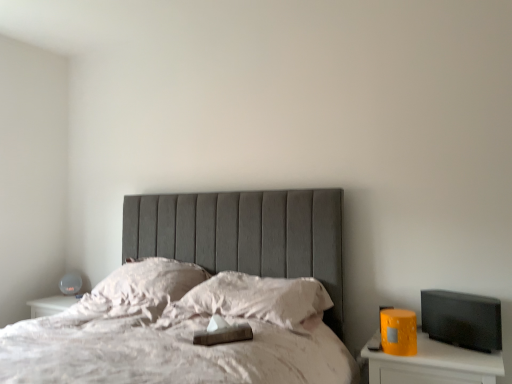
Image resolution: width=512 pixels, height=384 pixels. In order to click on white soft pillow at center, marked as the first pillow in a left-to-right arrangement in this screenshot , I will do `click(139, 290)`.

The image size is (512, 384). Identify the location of matte yellow nightstand at right. (434, 365).

Image resolution: width=512 pixels, height=384 pixels. Find the location of `white soft pillow at center, which ranks as the first pillow in right-to-left order`. white soft pillow at center, which ranks as the first pillow in right-to-left order is located at coordinates [251, 300].

Is matte white table lamp at left looking in the opposite direction of white soft pillow at center, which ranks as the first pillow in right-to-left order?

matte white table lamp at left does not have its back to white soft pillow at center, which ranks as the first pillow in right-to-left order.

Who is bigger, matte white table lamp at left or white soft pillow at center, which ranks as the first pillow in right-to-left order?

With larger size is white soft pillow at center, which ranks as the first pillow in right-to-left order.

Is white soft pillow at center, which ranks as the first pillow in right-to-left order, inside matte white table lamp at left?

No, white soft pillow at center, which ranks as the first pillow in right-to-left order, is located outside of matte white table lamp at left.

Which is more to the left, matte white table lamp at left or white soft pillow at center, which ranks as the first pillow in right-to-left order?

matte white table lamp at left is more to the left.

Based on the photo, from a real-world perspective, is white soft pillow at center, the 2th pillow when ordered from left to right, beneath white soft pillow at center, arranged as the 2th pillow when viewed from the right?

Indeed, from a real-world perspective, white soft pillow at center, the 2th pillow when ordered from left to right, is positioned beneath white soft pillow at center, arranged as the 2th pillow when viewed from the right.

Which object is further away from the camera, white soft pillow at center, which ranks as the first pillow in right-to-left order, or white soft pillow at center, arranged as the 2th pillow when viewed from the right?

white soft pillow at center, arranged as the 2th pillow when viewed from the right.

Considering the sizes of objects white soft pillow at center, which ranks as the first pillow in right-to-left order, and white soft pillow at center, arranged as the 2th pillow when viewed from the right, in the image provided, who is thinner, white soft pillow at center, which ranks as the first pillow in right-to-left order, or white soft pillow at center, arranged as the 2th pillow when viewed from the right,?

white soft pillow at center, which ranks as the first pillow in right-to-left order.

Is matte white table lamp at left at the back of white soft pillow at center, marked as the first pillow in a left-to-right arrangement?

No, matte white table lamp at left is not at the back of white soft pillow at center, marked as the first pillow in a left-to-right arrangement.

Between white soft pillow at center, marked as the first pillow in a left-to-right arrangement, and matte white table lamp at left, which one has larger size?

white soft pillow at center, marked as the first pillow in a left-to-right arrangement.

Is there a large distance between white soft pillow at center, marked as the first pillow in a left-to-right arrangement, and matte white table lamp at left?

No, there isn't a large distance between white soft pillow at center, marked as the first pillow in a left-to-right arrangement, and matte white table lamp at left.

From the image's perspective, who appears lower, white soft pillow at center, the 2th pillow when ordered from left to right, or matte yellow nightstand at right?

matte yellow nightstand at right appears lower in the image.

Could you tell me if white soft pillow at center, which ranks as the first pillow in right-to-left order, is turned towards matte yellow nightstand at right?

No, white soft pillow at center, which ranks as the first pillow in right-to-left order, is not turned towards matte yellow nightstand at right.

Measure the distance from white soft pillow at center, which ranks as the first pillow in right-to-left order, to matte yellow nightstand at right.

white soft pillow at center, which ranks as the first pillow in right-to-left order, and matte yellow nightstand at right are 55.54 centimeters apart from each other.

Which is more to the left, white soft pillow at center, arranged as the 2th pillow when viewed from the right, or matte yellow nightstand at right?

white soft pillow at center, arranged as the 2th pillow when viewed from the right.

From the image's perspective, which object appears higher, white soft pillow at center, marked as the first pillow in a left-to-right arrangement, or matte yellow nightstand at right?

white soft pillow at center, marked as the first pillow in a left-to-right arrangement.

Is white soft pillow at center, marked as the first pillow in a left-to-right arrangement, positioned before matte yellow nightstand at right?

No, white soft pillow at center, marked as the first pillow in a left-to-right arrangement, is further to the viewer.

Looking at their sizes, would you say white soft pillow at center, marked as the first pillow in a left-to-right arrangement, is wider or thinner than matte yellow nightstand at right?

white soft pillow at center, marked as the first pillow in a left-to-right arrangement, is wider than matte yellow nightstand at right.

Is matte white table lamp at left turned away from matte yellow nightstand at right?

No, matte white table lamp at left is not facing away from matte yellow nightstand at right.

Is matte white table lamp at left with matte yellow nightstand at right?

matte white table lamp at left is not next to matte yellow nightstand at right, and they're not touching.

Between matte white table lamp at left and matte yellow nightstand at right, which one has larger size?

matte yellow nightstand at right is bigger.

Consider the image. What's the angular difference between matte white table lamp at left and matte yellow nightstand at right's facing directions?

matte white table lamp at left and matte yellow nightstand at right are facing 34 degrees away from each other.

Does matte white table lamp at left lie behind white soft pillow at center, marked as the first pillow in a left-to-right arrangement?

Yes, matte white table lamp at left is further from the camera.

From a real-world perspective, between matte white table lamp at left and white soft pillow at center, arranged as the 2th pillow when viewed from the right, who is vertically higher?

white soft pillow at center, arranged as the 2th pillow when viewed from the right.

In order to click on the 1st pillow in front when counting from the matte white table lamp at left in this screenshot , I will do `click(139, 290)`.

In terms of width, does matte white table lamp at left look wider or thinner when compared to white soft pillow at center, marked as the first pillow in a left-to-right arrangement?

Clearly, matte white table lamp at left has less width compared to white soft pillow at center, marked as the first pillow in a left-to-right arrangement.

In order to click on the 2nd pillow in front of the matte white table lamp at left, counting from the anchor's position in this screenshot , I will do `click(251, 300)`.

At what (x,y) coordinates should I click in order to perform the action: click on pillow that appears behind the white soft pillow at center, the 2th pillow when ordered from left to right. Please return your answer as a coordinate pair (x, y). The width and height of the screenshot is (512, 384). Looking at the image, I should click on click(x=139, y=290).

Which object lies nearer to the anchor point white soft pillow at center, which ranks as the first pillow in right-to-left order, matte white table lamp at left or white soft pillow at center, arranged as the 2th pillow when viewed from the right?

white soft pillow at center, arranged as the 2th pillow when viewed from the right, is closer to white soft pillow at center, which ranks as the first pillow in right-to-left order.

Considering their positions, is matte white table lamp at left positioned further to matte yellow nightstand at right than white soft pillow at center, arranged as the 2th pillow when viewed from the right?

Among the two, matte white table lamp at left is located further to matte yellow nightstand at right.

Based on their spatial positions, is matte yellow nightstand at right or white soft pillow at center, marked as the first pillow in a left-to-right arrangement, further from white soft pillow at center, which ranks as the first pillow in right-to-left order?

Based on the image, matte yellow nightstand at right appears to be further to white soft pillow at center, which ranks as the first pillow in right-to-left order.

Considering their positions, is white soft pillow at center, marked as the first pillow in a left-to-right arrangement, positioned further to matte yellow nightstand at right than white soft pillow at center, the 2th pillow when ordered from left to right?

Among the two, white soft pillow at center, marked as the first pillow in a left-to-right arrangement, is located further to matte yellow nightstand at right.

Estimate the real-world distances between objects in this image. Which object is further from matte yellow nightstand at right, white soft pillow at center, arranged as the 2th pillow when viewed from the right, or matte white table lamp at left?

matte white table lamp at left is further to matte yellow nightstand at right.

From the image, which object appears to be farther from matte yellow nightstand at right, white soft pillow at center, which ranks as the first pillow in right-to-left order, or white soft pillow at center, arranged as the 2th pillow when viewed from the right?

white soft pillow at center, arranged as the 2th pillow when viewed from the right.

Based on their spatial positions, is white soft pillow at center, which ranks as the first pillow in right-to-left order, or matte yellow nightstand at right further from matte white table lamp at left?

matte yellow nightstand at right lies further to matte white table lamp at left than the other object.

Estimate the real-world distances between objects in this image. Which object is closer to white soft pillow at center, which ranks as the first pillow in right-to-left order, white soft pillow at center, marked as the first pillow in a left-to-right arrangement, or matte yellow nightstand at right?

The object closer to white soft pillow at center, which ranks as the first pillow in right-to-left order, is white soft pillow at center, marked as the first pillow in a left-to-right arrangement.

Where is `pillow between white soft pillow at center, arranged as the 2th pillow when viewed from the right, and matte yellow nightstand at right, in the horizontal direction`? The image size is (512, 384). pillow between white soft pillow at center, arranged as the 2th pillow when viewed from the right, and matte yellow nightstand at right, in the horizontal direction is located at coordinates (251, 300).

This screenshot has height=384, width=512. Identify the location of pillow between white soft pillow at center, the 2th pillow when ordered from left to right, and matte white table lamp at left in the front-back direction. (139, 290).